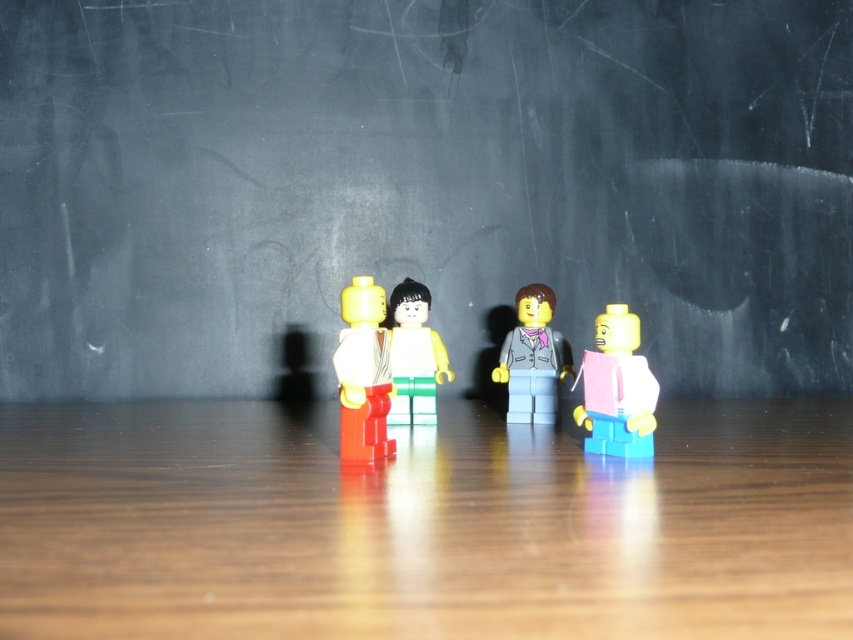
Question: Which point appears closest to the camera in this image?

Choices:
 (A) (432, 416)
 (B) (370, 337)
 (C) (537, 356)

Answer: (B)

Question: Estimate the real-world distances between objects in this image. Which object is farther from the matte pink book at right?

Choices:
 (A) matte gray suit at center
 (B) matte yellow minifigure at center

Answer: (B)

Question: Is matte plastic minifigure at center wider than matte yellow minifigure at center?

Choices:
 (A) no
 (B) yes

Answer: (A)

Question: Can you confirm if matte plastic minifigure at center is thinner than matte gray suit at center?

Choices:
 (A) yes
 (B) no

Answer: (A)

Question: Which point is farther to the camera?

Choices:
 (A) matte yellow minifigure at center
 (B) matte pink book at right
 (C) matte gray suit at center
 (D) matte plastic minifigure at center

Answer: (C)

Question: Does matte pink book at right have a lesser width compared to matte yellow minifigure at center?

Choices:
 (A) yes
 (B) no

Answer: (B)